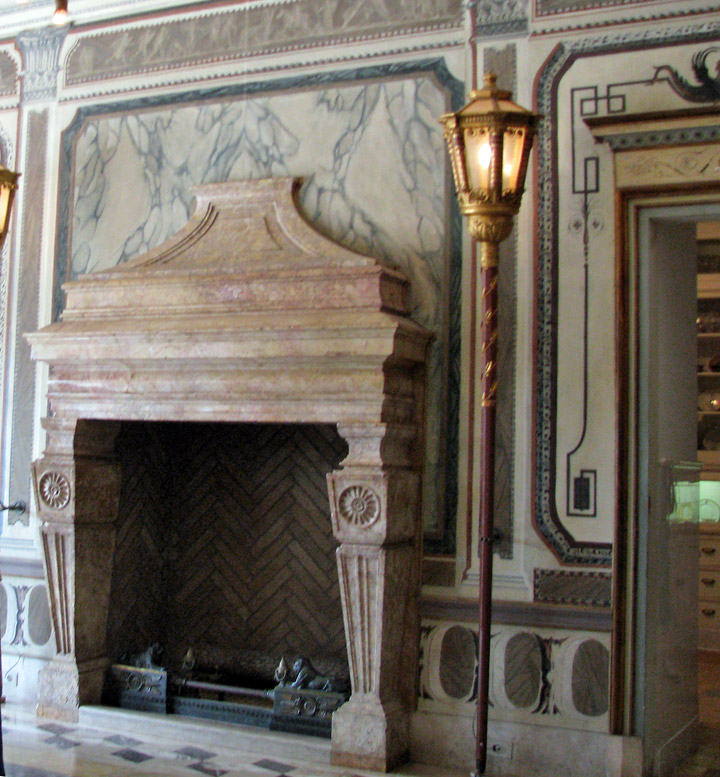
Find the location of a particular element. lamp is located at coordinates (486, 258).